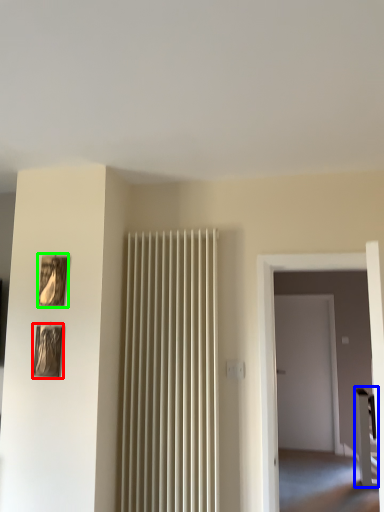
Question: Estimate the real-world distances between objects in this image. Which object is closer to picture frame (highlighted by a red box), furniture (highlighted by a blue box) or picture frame (highlighted by a green box)?

Choices:
 (A) furniture
 (B) picture frame

Answer: (B)